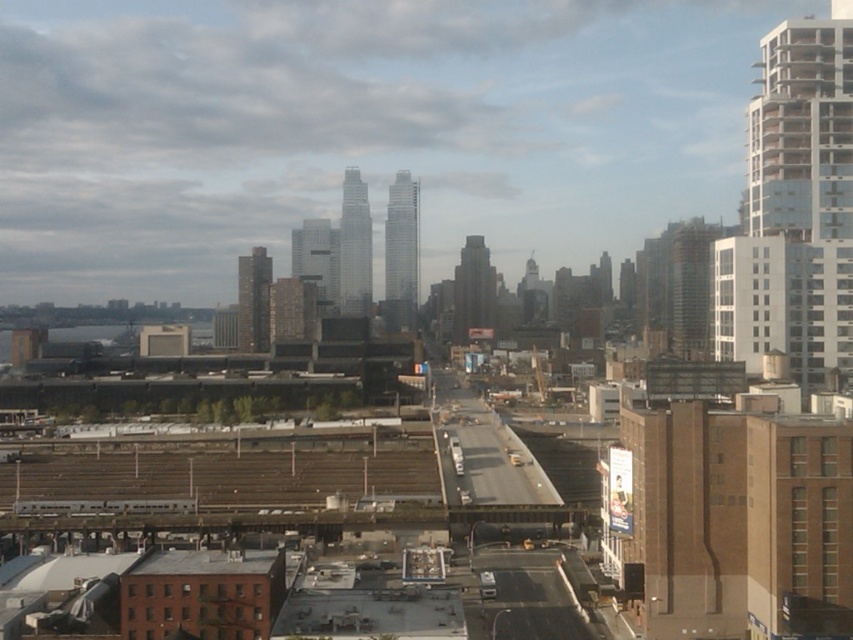
Question: Can you confirm if dark gray concrete skyscraper at center is wider than glassy reflective skyscraper at center?

Choices:
 (A) yes
 (B) no

Answer: (B)

Question: Estimate the real-world distances between objects in this image. Which object is closer to the dark gray concrete skyscraper at center?

Choices:
 (A) white glass building at upper right
 (B) glassy reflective skyscraper at center

Answer: (B)

Question: Does white glass building at upper right appear on the right side of glassy reflective skyscraper at center?

Choices:
 (A) no
 (B) yes

Answer: (B)

Question: Among these objects, which one is nearest to the camera?

Choices:
 (A) smooth glass skyscraper at center
 (B) glassy steel skyscraper at center
 (C) brown brick building at center

Answer: (B)

Question: Does white glass building at upper right appear on the left side of glassy steel skyscraper at center?

Choices:
 (A) no
 (B) yes

Answer: (A)

Question: Which object appears farthest from the camera in this image?

Choices:
 (A) smooth glass skyscraper at center
 (B) glassy steel skyscraper at center
 (C) glassy reflective skyscraper at center

Answer: (A)